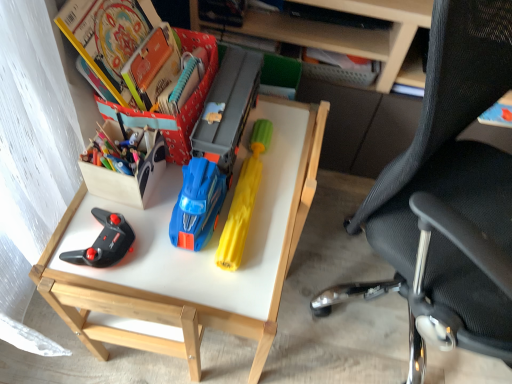
Find the location of a particular element. black mesh chair at right is located at coordinates (448, 197).

This screenshot has width=512, height=384. Describe the element at coordinates (448, 197) in the screenshot. I see `black mesh chair at right` at that location.

What is the approximate width of matte plastic desk at center?

The width of matte plastic desk at center is 25.99 inches.

You are a GUI agent. You are given a task and a screenshot of the screen. Output one action in this format:
    pyautogui.click(x=<x>, y=<y>)
    Task: Click on the hardcover book at upper left, positioned as the 3th book in back-to-front order
    The image size is (512, 384).
    Given the screenshot: What is the action you would take?
    pyautogui.click(x=109, y=38)

Identify the location of yellow rubber toy at center. (243, 200).

This screenshot has width=512, height=384. Find the location of `matte paper book at upper left, placed as the first book when sorted from back to front`. matte paper book at upper left, placed as the first book when sorted from back to front is located at coordinates (185, 104).

Between matte paper book at upper left, placed as the first book when sorted from back to front, and hardcover book at upper left, which is counted as the first book, starting from the front, which one has more height?

With more height is hardcover book at upper left, which is counted as the first book, starting from the front.

From a real-world perspective, which object stands above the other?

From a 3D spatial view, hardcover book at upper left, positioned as the 3th book in back-to-front order, is above.

Considering the relative sizes of matte paper book at upper left, placed as the first book when sorted from back to front, and hardcover book at upper left, positioned as the 3th book in back-to-front order, in the image provided, is matte paper book at upper left, placed as the first book when sorted from back to front, thinner than hardcover book at upper left, positioned as the 3th book in back-to-front order,?

No, matte paper book at upper left, placed as the first book when sorted from back to front, is not thinner than hardcover book at upper left, positioned as the 3th book in back-to-front order.

Who is bigger, matte paper book at upper left, placed as the first book when sorted from back to front, or hardcover book at upper left, positioned as the 3th book in back-to-front order?

With larger size is matte paper book at upper left, placed as the first book when sorted from back to front.

Is yellow rubber toy at center to the left or to the right of black mesh chair at right in the image?

From the image, it's evident that yellow rubber toy at center is to the left of black mesh chair at right.

Does point (221, 261) lie behind point (457, 267)?

Yes.

From a real-world perspective, who is located lower, yellow rubber toy at center or black mesh chair at right?

yellow rubber toy at center, from a real-world perspective.

Is yellow rubber toy at center further to camera compared to black mesh chair at right?

Yes, it is.

Can you confirm if orange cardboard book at upper left, the second book when ordered from back to front, is taller than yellow rubber toy at center?

Yes.

From the image's perspective, between orange cardboard book at upper left, placed as the second book when sorted from front to back, and yellow rubber toy at center, which one is located above?

orange cardboard book at upper left, placed as the second book when sorted from front to back, is shown above in the image.

Is orange cardboard book at upper left, the second book when ordered from back to front, located outside yellow rubber toy at center?

orange cardboard book at upper left, the second book when ordered from back to front, is positioned outside yellow rubber toy at center.

Could you tell me if matte plastic desk at center is facing yellow rubber toy at center?

No, matte plastic desk at center is not facing towards yellow rubber toy at center.

Is point (304, 178) behind point (240, 199)?

Yes, it is behind point (240, 199).

Is matte plastic desk at center thinner than yellow rubber toy at center?

No.

From the picture: Considering the relative sizes of matte plastic desk at center and yellow rubber toy at center in the image provided, is matte plastic desk at center taller than yellow rubber toy at center?

Yes, matte plastic desk at center is taller than yellow rubber toy at center.

In the scene shown: Is matte plastic desk at center completely or partially outside of matte paper book at upper left, the 3th book in the front-to-back sequence?

Absolutely, matte plastic desk at center is external to matte paper book at upper left, the 3th book in the front-to-back sequence.

Looking at their sizes, would you say matte plastic desk at center is wider or thinner than matte paper book at upper left, the 3th book in the front-to-back sequence?

In the image, matte plastic desk at center appears to be wider than matte paper book at upper left, the 3th book in the front-to-back sequence.

From a real-world perspective, between matte plastic desk at center and matte paper book at upper left, the 3th book in the front-to-back sequence, who is vertically lower?

matte plastic desk at center.

Between matte plastic desk at center and matte paper book at upper left, the 3th book in the front-to-back sequence, which one has larger size?

With larger size is matte plastic desk at center.

Locate an element on the screen. The image size is (512, 384). chair on the right of orange cardboard book at upper left, placed as the second book when sorted from front to back is located at coordinates (448, 197).

Measure the distance between black mesh chair at right and orange cardboard book at upper left, the second book when ordered from back to front.

The distance of black mesh chair at right from orange cardboard book at upper left, the second book when ordered from back to front, is 25.03 inches.

Considering the relative sizes of black mesh chair at right and orange cardboard book at upper left, placed as the second book when sorted from front to back, in the image provided, is black mesh chair at right taller than orange cardboard book at upper left, placed as the second book when sorted from front to back,?

Yes.

From the image's perspective, who appears lower, black mesh chair at right or orange cardboard book at upper left, the second book when ordered from back to front?

From the image's view, black mesh chair at right is below.

Can you confirm if orange cardboard book at upper left, the second book when ordered from back to front, is shorter than wooden box at left?

Yes, orange cardboard book at upper left, the second book when ordered from back to front, is shorter than wooden box at left.

Does orange cardboard book at upper left, the second book when ordered from back to front, touch wooden box at left?

A: They are not placed beside each other.

From the image's perspective, is orange cardboard book at upper left, placed as the second book when sorted from front to back, positioned above or below wooden box at left?

Clearly, from the image's perspective, orange cardboard book at upper left, placed as the second book when sorted from front to back, is above wooden box at left.

From the matte paper book at upper left, the 3th book in the front-to-back sequence, count the 2nd book to the left and point to it. Please provide its 2D coordinates.

[(109, 38)]

Where is `chair on the right side of yellow rubber toy at center`? The image size is (512, 384). chair on the right side of yellow rubber toy at center is located at coordinates (448, 197).

When comparing their distances from matte plastic desk at center, does wooden box at left or orange cardboard book at upper left, the second book when ordered from back to front, seem further?

Among the two, orange cardboard book at upper left, the second book when ordered from back to front, is located further to matte plastic desk at center.

From the picture: From the image, which object appears to be nearer to hardcover book at upper left, positioned as the 3th book in back-to-front order, wooden box at left or black mesh chair at right?

wooden box at left is closer to hardcover book at upper left, positioned as the 3th book in back-to-front order.

When comparing their distances from orange cardboard book at upper left, the second book when ordered from back to front, does matte paper book at upper left, placed as the first book when sorted from back to front, or hardcover book at upper left, positioned as the 3th book in back-to-front order, seem further?

matte paper book at upper left, placed as the first book when sorted from back to front, lies further to orange cardboard book at upper left, the second book when ordered from back to front, than the other object.

Estimate the real-world distances between objects in this image. Which object is further from matte paper book at upper left, placed as the first book when sorted from back to front, matte plastic desk at center or hardcover book at upper left, positioned as the 3th book in back-to-front order?

Among the two, matte plastic desk at center is located further to matte paper book at upper left, placed as the first book when sorted from back to front.

Estimate the real-world distances between objects in this image. Which object is closer to yellow rubber toy at center, hardcover book at upper left, positioned as the 3th book in back-to-front order, or matte plastic desk at center?

matte plastic desk at center.

Estimate the real-world distances between objects in this image. Which object is closer to matte plastic desk at center, matte paper book at upper left, placed as the first book when sorted from back to front, or black mesh chair at right?

matte paper book at upper left, placed as the first book when sorted from back to front, lies closer to matte plastic desk at center than the other object.

In the scene shown: Which object lies nearer to the anchor point hardcover book at upper left, which is counted as the first book, starting from the front, black mesh chair at right or orange cardboard book at upper left, the second book when ordered from back to front?

orange cardboard book at upper left, the second book when ordered from back to front.

Consider the image. When comparing their distances from yellow rubber toy at center, does matte plastic desk at center or matte paper book at upper left, placed as the first book when sorted from back to front, seem further?

matte paper book at upper left, placed as the first book when sorted from back to front.

Where is `desk located between matte paper book at upper left, the 3th book in the front-to-back sequence, and black mesh chair at right in the left-right direction`? The image size is (512, 384). desk located between matte paper book at upper left, the 3th book in the front-to-back sequence, and black mesh chair at right in the left-right direction is located at coordinates (192, 255).

Locate an element on the screen. toy between orange cardboard book at upper left, the second book when ordered from back to front, and matte plastic desk at center in the up-down direction is located at coordinates (243, 200).

Find the location of `kit that lies between hardcover book at upper left, which is counted as the first book, starting from the front, and matte plastic desk at center from top to bottom`. kit that lies between hardcover book at upper left, which is counted as the first book, starting from the front, and matte plastic desk at center from top to bottom is located at coordinates [x=128, y=176].

I want to click on toy located between orange cardboard book at upper left, the second book when ordered from back to front, and black mesh chair at right in the left-right direction, so click(x=243, y=200).